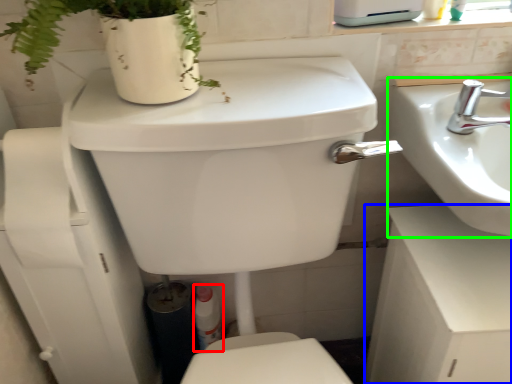
Question: Which object is the closest to the toiletry (highlighted by a red box)? Choose among these: counter top (highlighted by a blue box) or sink (highlighted by a green box).

Choices:
 (A) counter top
 (B) sink

Answer: (A)